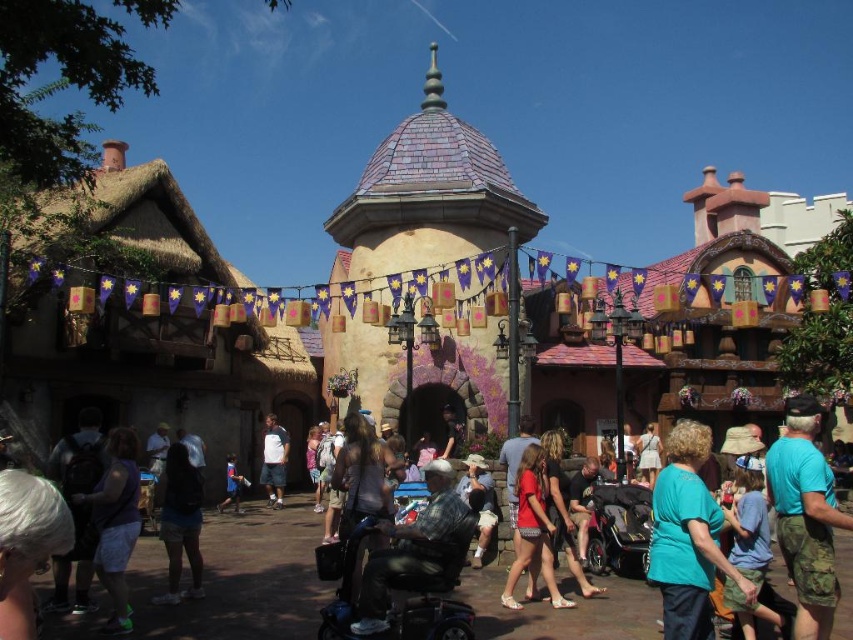
Measure the distance between point (770, 556) and camera.

Point (770, 556) and camera are 48.43 meters apart.

Between blue cotton shirt at lower right and matte red shorts at center, which one appears on the right side from the viewer's perspective?

From the viewer's perspective, blue cotton shirt at lower right appears more on the right side.

Who is more distant from viewer, (753, 564) or (590, 582)?

Positioned behind is point (590, 582).

Locate an element on the screen. The height and width of the screenshot is (640, 853). blue cotton shirt at lower right is located at coordinates (749, 529).

Which is more to the left, dark gray wheelchair at lower center or black plastic baby carriage at lower center?

From the viewer's perspective, black plastic baby carriage at lower center appears more on the left side.

Consider the image. Can you confirm if dark gray wheelchair at lower center is wider than black plastic baby carriage at lower center?

Indeed, dark gray wheelchair at lower center has a greater width compared to black plastic baby carriage at lower center.

Does point (273, 636) come closer to viewer compared to point (404, 602)?

Yes, point (273, 636) is in front of point (404, 602).

Identify the location of dark gray wheelchair at lower center. Image resolution: width=853 pixels, height=640 pixels. (227, 582).

Is teal fabric shirt at center to the left of matte red shorts at center from the viewer's perspective?

No, teal fabric shirt at center is not to the left of matte red shorts at center.

In the scene shown: Can you confirm if teal fabric shirt at center is positioned above matte red shorts at center?

Indeed, teal fabric shirt at center is positioned over matte red shorts at center.

Is point (664, 506) positioned behind point (556, 432)?

No.

What are the coordinates of `teal fabric shirt at center` in the screenshot? It's located at (688, 538).